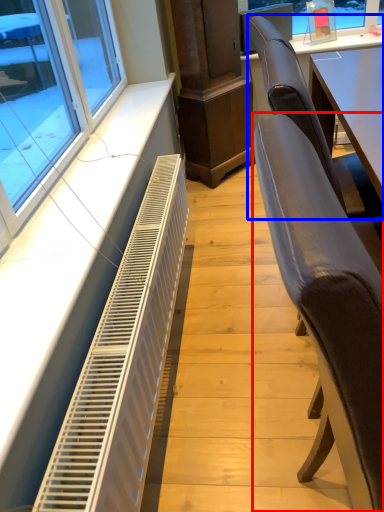
Question: Which object is closer to the camera taking this photo, chair (highlighted by a red box) or chair (highlighted by a blue box)?

Choices:
 (A) chair
 (B) chair

Answer: (A)